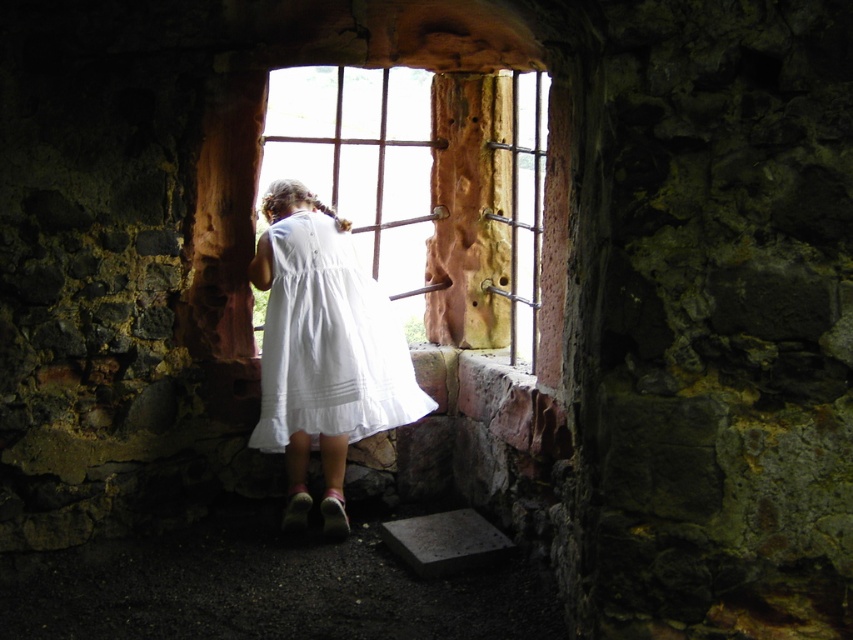
You are a tailor measuring the distance between the wooden at center and the white cotton dress at center for a costume design. Can you confirm if the distance is sufficient to allow a 50 centimeter long ribbon to be tied between them without touching?

The wooden at center is 55.76 centimeters away from the white cotton dress at center. Since the ribbon is 50 centimeters long, it can be tied between them without touching as there is enough space.

You are a photographer trying to capture a shot of the wooden at center and the white cotton dress at center. Which object should you focus on first if you want to ensure both are in the frame without moving the camera?

You should focus on the wooden at center first because it is taller than the white cotton dress at center, ensuring its full height is captured before adjusting for the dress.

You are an architect inspecting the old stone structure. You notice a wooden object at center. Based on its coordinates, where exactly is the wooden at center located in the image?

The wooden at center is located at the coordinates point (x=456, y=202) in the image.